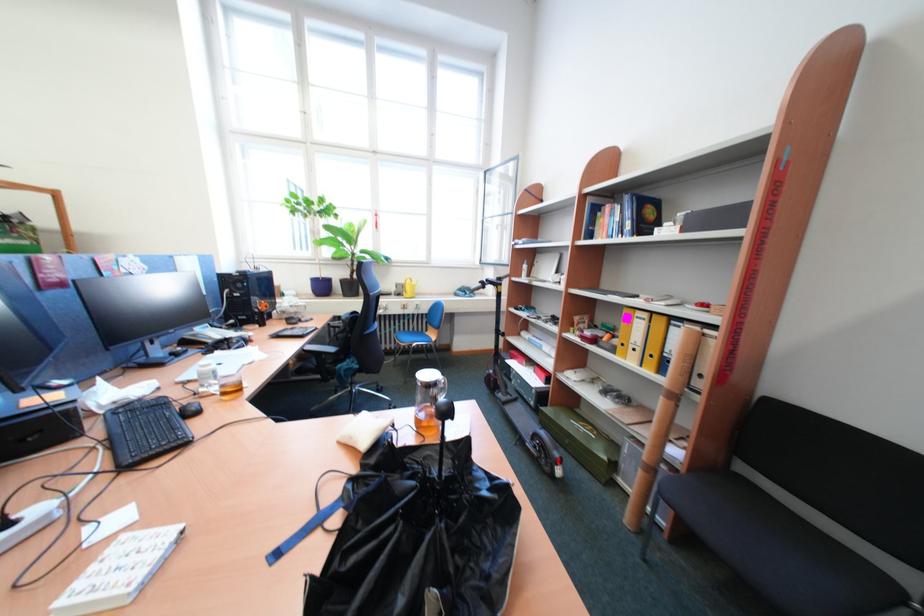
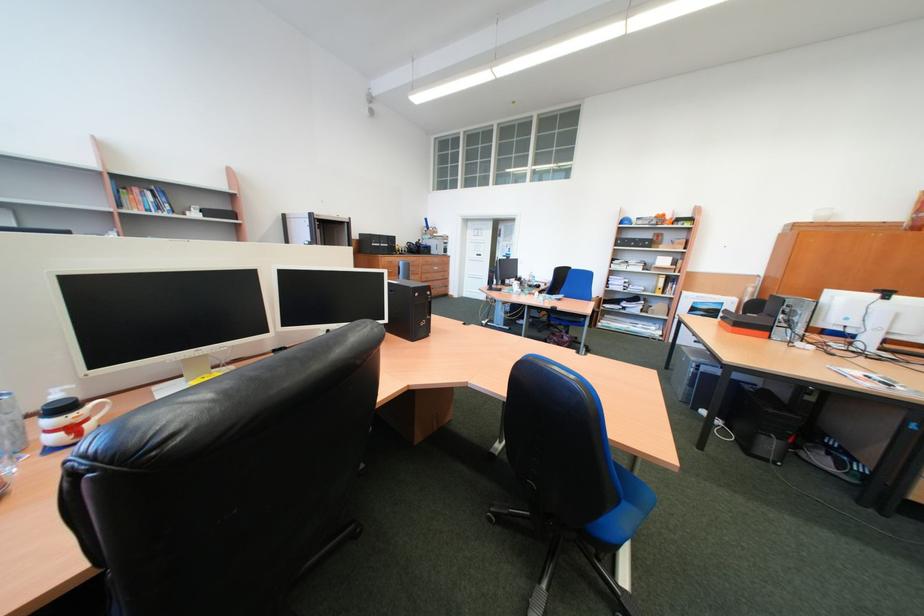
Question: I am providing you with two images of the same scene from different viewpoints. Please identify which objects are invisible in image2.

Choices:
 (A) clear plastic bottle
 (B) plant pot
 (C) white covered book
 (D) dark drawer handle

Answer: (C)